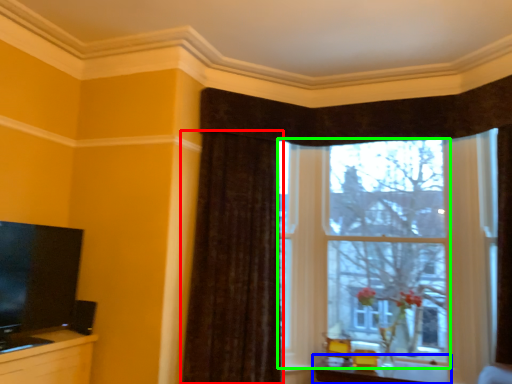
Question: Estimate the real-world distances between objects in this image. Which object is farther from curtain (highlighted by a red box), table (highlighted by a blue box) or window (highlighted by a green box)?

Choices:
 (A) table
 (B) window

Answer: (A)